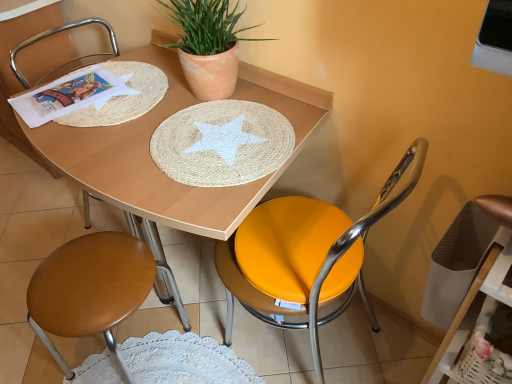
Image resolution: width=512 pixels, height=384 pixels. I want to click on free space to the right of matte terracotta pot at upper center, so click(x=287, y=105).